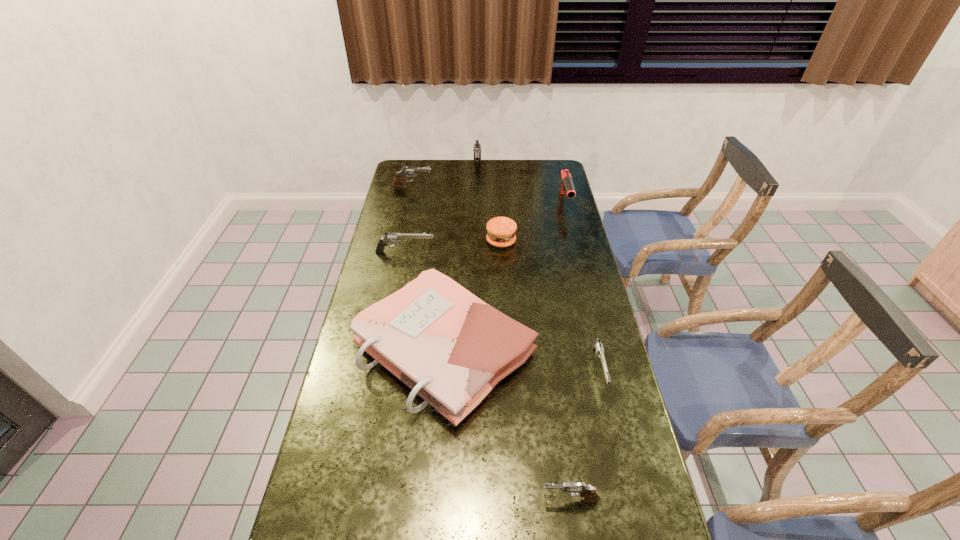
The height and width of the screenshot is (540, 960). What are the coordinates of `vacant space that is in between the patty and the nearest gray pistol` in the screenshot? It's located at (536, 370).

The image size is (960, 540). What are the coordinates of `free space between the gun and the smaller silver pistol` in the screenshot? It's located at (582, 285).

In order to click on free space between the nearer silver pistol and the second farthest pistol in this screenshot , I will do `click(506, 279)`.

I want to click on empty space between the fourth nearest pistol and the shortest object, so click(x=506, y=279).

This screenshot has height=540, width=960. I want to click on free spot between the biggest gray pistol and the phonebook, so click(461, 260).

Find the location of a particular element. This screenshot has height=540, width=960. empty space that is in between the gun and the rightmost pistol is located at coordinates (582, 285).

This screenshot has width=960, height=540. Find the location of `free space between the second nearest gray pistol and the phonebook`. free space between the second nearest gray pistol and the phonebook is located at coordinates (429, 269).

You are a GUI agent. You are given a task and a screenshot of the screen. Output one action in this format:
    pyautogui.click(x=<x>, y=<y>)
    Task: Click on the object that is the sixth closest one to the farther silver pistol
    
    Given the screenshot: What is the action you would take?
    pyautogui.click(x=596, y=344)

Identify which object is located as the second nearest to the second farthest gray pistol. Please provide its 2D coordinates. Your answer should be formatted as a tuple, i.e. [(x, y)], where the tuple contains the x and y coordinates of a point satisfying the conditions above.

[(500, 230)]

The width and height of the screenshot is (960, 540). In order to click on pistol that can be found as the third closest to the patty in this screenshot , I will do `click(407, 171)`.